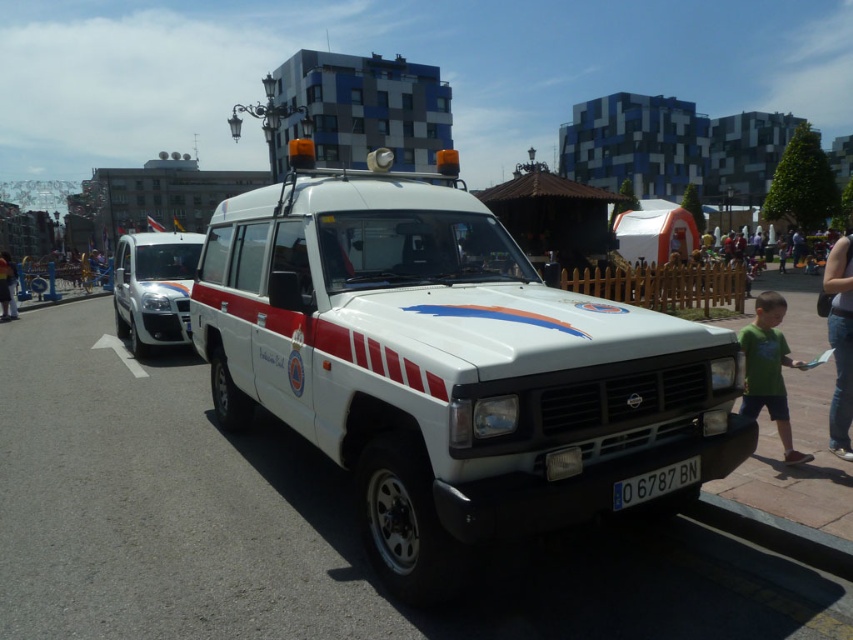
From the picture: You are a pedestrian standing on the sidewalk and see the white matte fire truck at center and the white glossy van at left. Which vehicle is closer to you?

The white matte fire truck at center is closer to you because it is in front of the white glossy van at left.

Looking at this image, you are a delivery person trying to park your 2.5 meters tall delivery truck. You see the white matte fire truck at center and the white glossy van at left. Which vehicle should you park behind to ensure your truck can fit vertically without hitting the roof?

The white matte fire truck at center has a lesser height compared to white glossy van at left. Therefore, you should park behind the white matte fire truck at center since it is shorter, allowing your 2.5 meters tall delivery truck to fit vertically without hitting the roof.